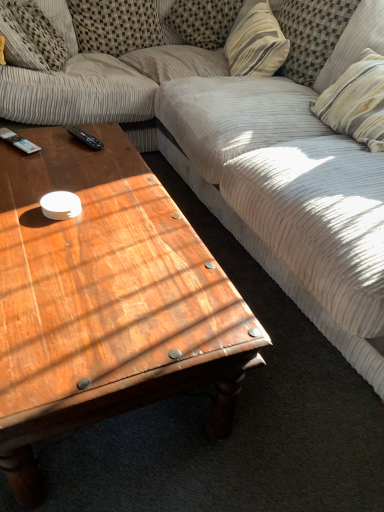
The width and height of the screenshot is (384, 512). I want to click on unoccupied region to the right of black plastic remote at center, which is the 2th remote control in left-to-right order, so click(x=117, y=148).